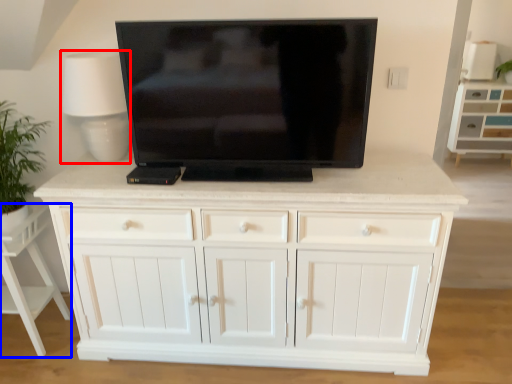
Question: Which object is closer to the camera taking this photo, table lamp (highlighted by a red box) or vanity (highlighted by a blue box)?

Choices:
 (A) table lamp
 (B) vanity

Answer: (A)